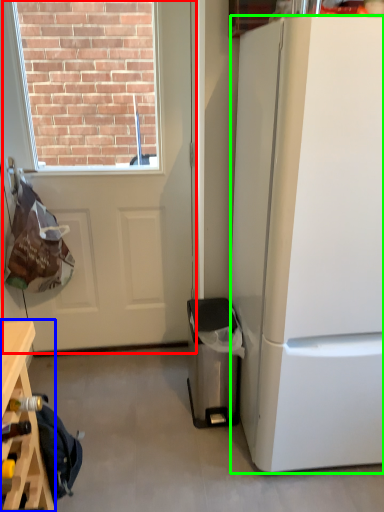
Question: Which object is positioned closest to door (highlighted by a red box)? Select from table (highlighted by a blue box) and refrigerator (highlighted by a green box).

Choices:
 (A) table
 (B) refrigerator

Answer: (B)